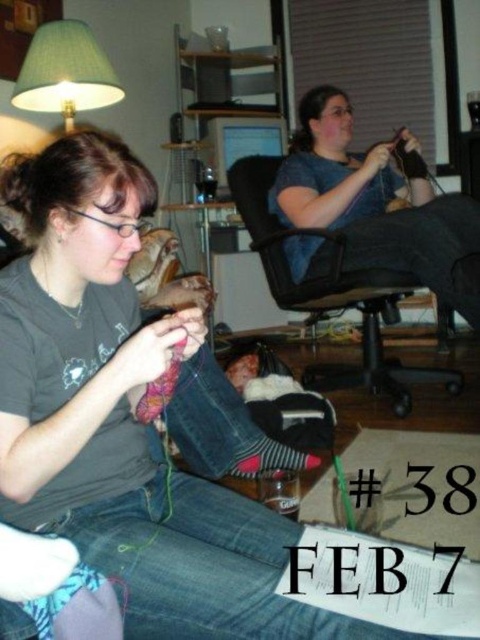
Who is more distant from viewer, (440, 209) or (265, 272)?

Positioned behind is point (265, 272).

Is matte blue shirt at upper right positioned at the back of black mesh office chair at center?

No.

The height and width of the screenshot is (640, 480). What do you see at coordinates (376, 205) in the screenshot?
I see `matte blue shirt at upper right` at bounding box center [376, 205].

Locate an element on the screen. This screenshot has width=480, height=640. matte blue shirt at upper right is located at coordinates (376, 205).

Is denim at left bigger than green fabric lampshade at upper left?

No, denim at left is not bigger than green fabric lampshade at upper left.

Is point (177, 630) closer to camera compared to point (57, 54)?

Yes, point (177, 630) is closer to viewer.

I want to click on denim at left, so click(202, 564).

Between point (355, 173) and point (45, 102), which one is positioned behind?

Positioned behind is point (45, 102).

Can you confirm if matte blue shirt at upper right is shorter than green fabric lampshade at upper left?

Incorrect, matte blue shirt at upper right's height does not fall short of green fabric lampshade at upper left's.

Identify the location of matte blue shirt at upper right. This screenshot has height=640, width=480. (376, 205).